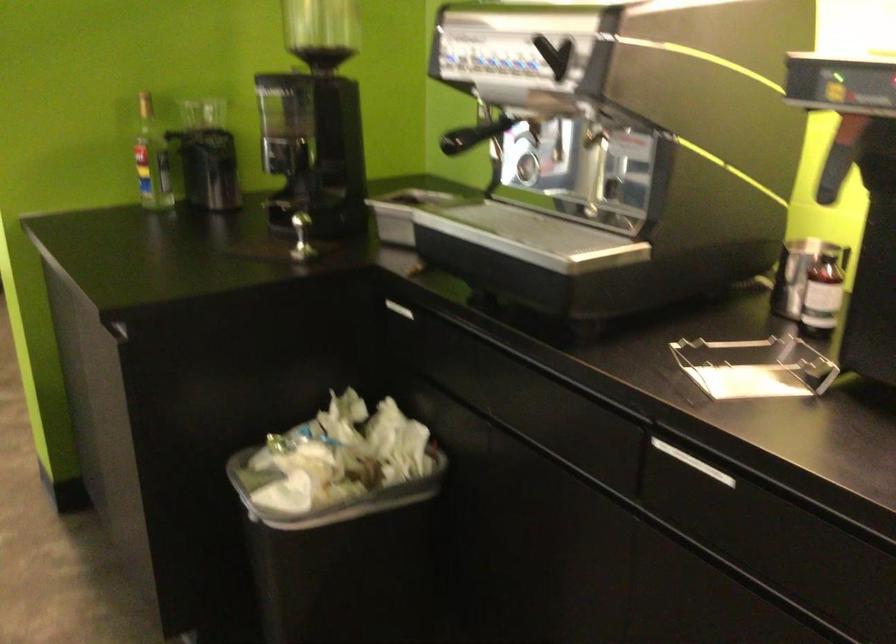
You are a GUI agent. You are given a task and a screenshot of the screen. Output one action in this format:
    pyautogui.click(x=<x>, y=<y>)
    Task: Click on the espresso machine lever
    The image size is (896, 644).
    Given the screenshot: What is the action you would take?
    pyautogui.click(x=592, y=171)